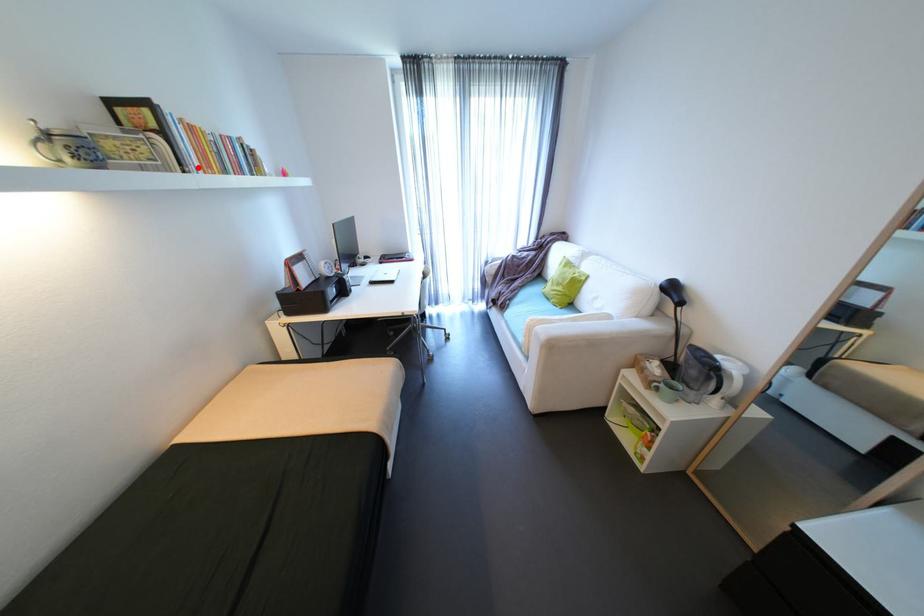
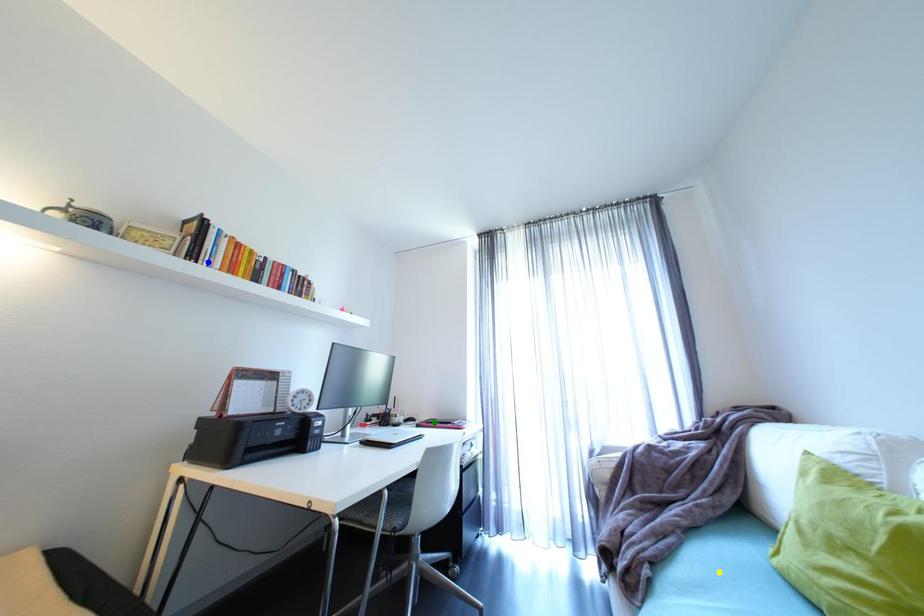
Question: I am providing you with two images of the same scene from different viewpoints. A red point is marked on the first image. You are given multiple points on the second image. In image 2, which mark is for the same physical point as the one in image 1?

Choices:
 (A) blue point
 (B) green point
 (C) yellow point

Answer: (A)